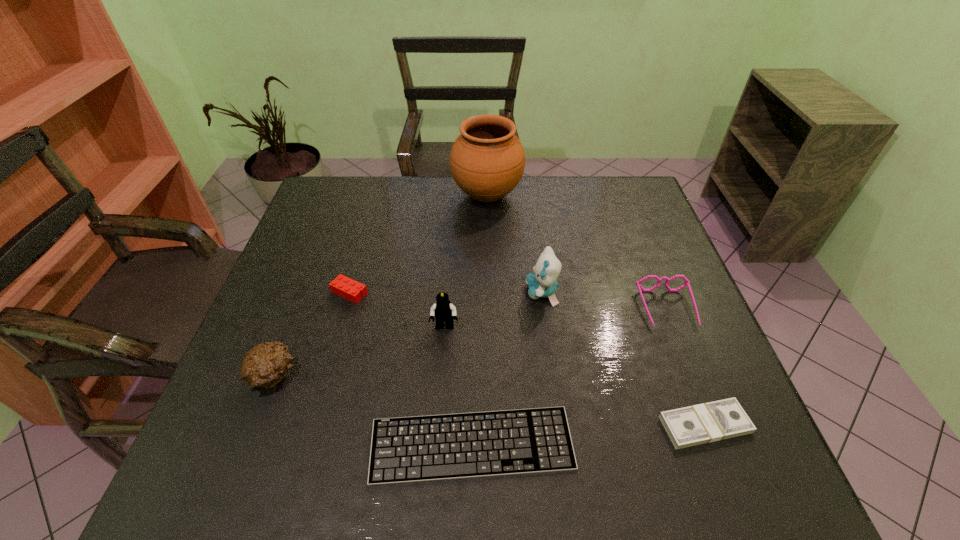
Identify the location of vacant space located 0.180m on the left of the second shortest object. This screenshot has height=540, width=960. (569, 425).

Locate an element on the screen. This screenshot has width=960, height=540. free space located on the back of the shortest object is located at coordinates (473, 308).

Locate an element on the screen. This screenshot has width=960, height=540. object positioned at the far edge is located at coordinates tap(487, 160).

The height and width of the screenshot is (540, 960). In order to click on dollar positioned at the near edge in this screenshot , I will do `click(718, 420)`.

I want to click on computer keyboard situated at the near edge, so click(x=495, y=443).

What are the coordinates of `muffin that is at the left edge` in the screenshot? It's located at (264, 366).

Where is `Lego located at the left edge`? Lego located at the left edge is located at coordinates (350, 289).

Locate an element on the screen. Image resolution: width=960 pixels, height=540 pixels. spectacles located in the right edge section of the desktop is located at coordinates (687, 283).

Find the location of a particular element. The width and height of the screenshot is (960, 540). dollar located at the right edge is located at coordinates (718, 420).

Locate an element on the screen. This screenshot has height=540, width=960. object that is at the near right corner is located at coordinates (718, 420).